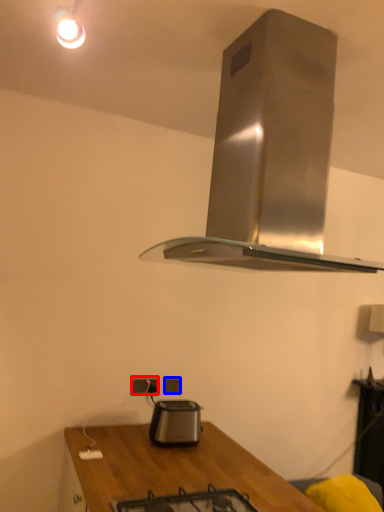
Question: Which point is further to the camera, electric outlet (highlighted by a red box) or electric outlet (highlighted by a blue box)?

Choices:
 (A) electric outlet
 (B) electric outlet

Answer: (B)